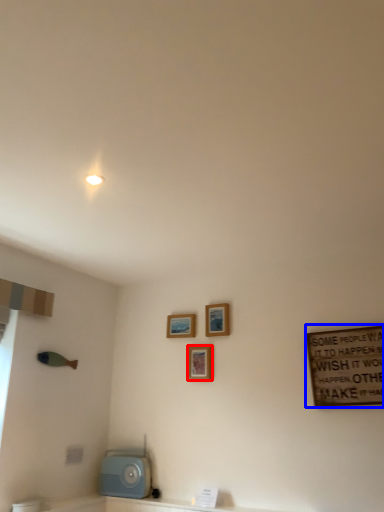
Question: Which object is further to the camera taking this photo, picture frame (highlighted by a red box) or bulletin board (highlighted by a blue box)?

Choices:
 (A) picture frame
 (B) bulletin board

Answer: (A)